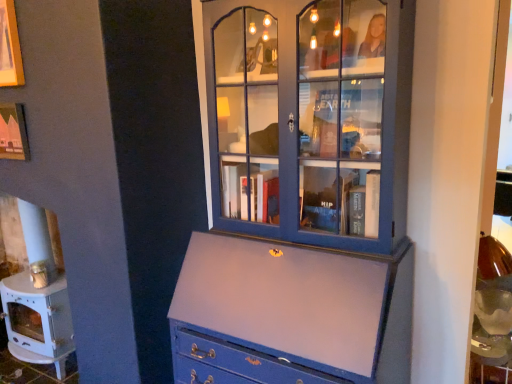
Question: Is white glossy fireplace at lower left smaller than blue painted wood cabinet at center?

Choices:
 (A) no
 (B) yes

Answer: (B)

Question: Is white glossy fireplace at lower left in front of blue painted wood cabinet at center?

Choices:
 (A) yes
 (B) no

Answer: (B)

Question: Is white glossy fireplace at lower left turned away from blue painted wood cabinet at center?

Choices:
 (A) yes
 (B) no

Answer: (B)

Question: Can you confirm if white glossy fireplace at lower left is thinner than blue painted wood cabinet at center?

Choices:
 (A) yes
 (B) no

Answer: (A)

Question: Does white glossy fireplace at lower left have a lesser height compared to blue painted wood cabinet at center?

Choices:
 (A) no
 (B) yes

Answer: (B)

Question: Is white glossy fireplace at lower left positioned far away from blue painted wood cabinet at center?

Choices:
 (A) no
 (B) yes

Answer: (B)

Question: Is blue painted wood cabinet at center next to white glossy fireplace at lower left?

Choices:
 (A) yes
 (B) no

Answer: (B)

Question: From the image's perspective, is blue painted wood cabinet at center on white glossy fireplace at lower left?

Choices:
 (A) no
 (B) yes

Answer: (B)

Question: Considering the relative positions of blue painted wood cabinet at center and white glossy fireplace at lower left in the image provided, is blue painted wood cabinet at center behind white glossy fireplace at lower left?

Choices:
 (A) yes
 (B) no

Answer: (B)

Question: Does blue painted wood cabinet at center have a larger size compared to white glossy fireplace at lower left?

Choices:
 (A) no
 (B) yes

Answer: (B)

Question: Is blue painted wood cabinet at center closer to camera compared to white glossy fireplace at lower left?

Choices:
 (A) yes
 (B) no

Answer: (A)

Question: Can you confirm if blue painted wood cabinet at center is wider than white glossy fireplace at lower left?

Choices:
 (A) no
 (B) yes

Answer: (B)

Question: Considering the positions of blue painted wood cabinet at center and white glossy fireplace at lower left in the image, is blue painted wood cabinet at center bigger or smaller than white glossy fireplace at lower left?

Choices:
 (A) small
 (B) big

Answer: (B)